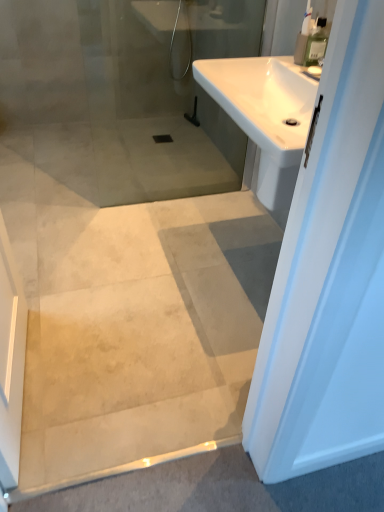
Question: Is clear plastic bottle at upper right completely or partially outside of white glossy sink at upper right?

Choices:
 (A) yes
 (B) no

Answer: (A)

Question: Is clear plastic bottle at upper right bigger than white glossy sink at upper right?

Choices:
 (A) no
 (B) yes

Answer: (A)

Question: Does clear plastic bottle at upper right appear on the left side of white glossy sink at upper right?

Choices:
 (A) no
 (B) yes

Answer: (A)

Question: Considering the relative sizes of clear plastic bottle at upper right and white glossy sink at upper right in the image provided, is clear plastic bottle at upper right shorter than white glossy sink at upper right?

Choices:
 (A) no
 (B) yes

Answer: (A)

Question: Is clear plastic bottle at upper right behind white glossy sink at upper right?

Choices:
 (A) no
 (B) yes

Answer: (B)

Question: Considering the relative sizes of clear plastic bottle at upper right and white glossy sink at upper right in the image provided, is clear plastic bottle at upper right smaller than white glossy sink at upper right?

Choices:
 (A) no
 (B) yes

Answer: (B)

Question: From a real-world perspective, is white glossy sink at upper right located beneath clear plastic bottle at upper right?

Choices:
 (A) no
 (B) yes

Answer: (B)

Question: Considering the relative positions of white glossy sink at upper right and clear plastic bottle at upper right in the image provided, is white glossy sink at upper right behind clear plastic bottle at upper right?

Choices:
 (A) yes
 (B) no

Answer: (B)

Question: From the image's perspective, is white glossy sink at upper right over clear plastic bottle at upper right?

Choices:
 (A) yes
 (B) no

Answer: (B)

Question: Can you see white glossy sink at upper right touching clear plastic bottle at upper right?

Choices:
 (A) no
 (B) yes

Answer: (A)

Question: Is white glossy sink at upper right outside clear plastic bottle at upper right?

Choices:
 (A) no
 (B) yes

Answer: (B)

Question: Is clear plastic bottle at upper right at the back of white glossy sink at upper right?

Choices:
 (A) yes
 (B) no

Answer: (B)

Question: From the image's perspective, is clear plastic bottle at upper right above or below white glossy sink at upper right?

Choices:
 (A) above
 (B) below

Answer: (A)